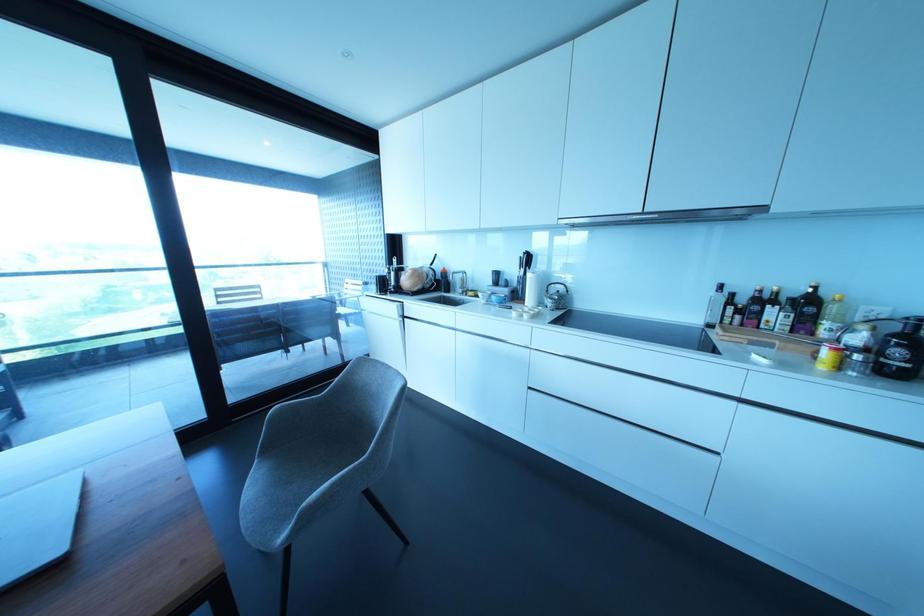
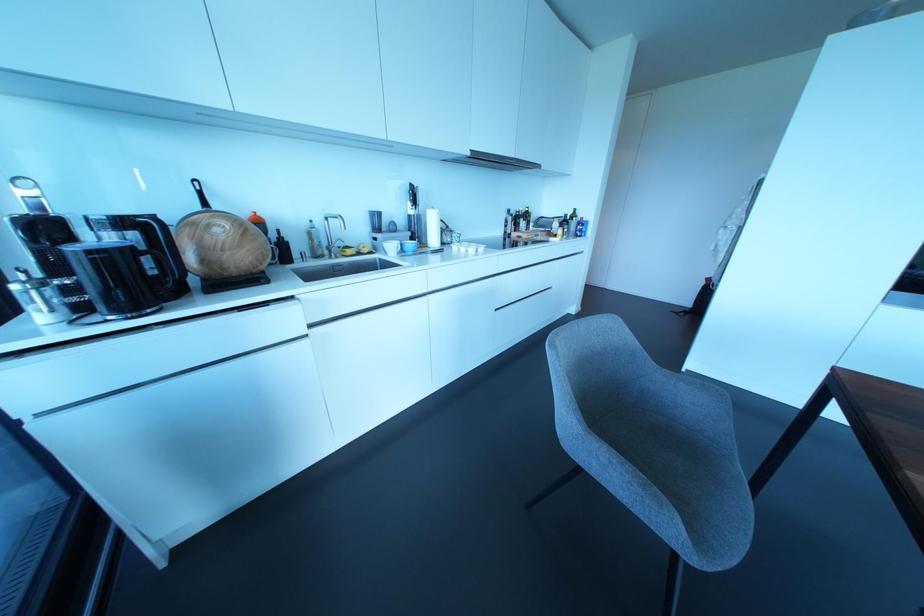
Find the pixel in the second image that matches (431,262) in the first image.

(204, 204)